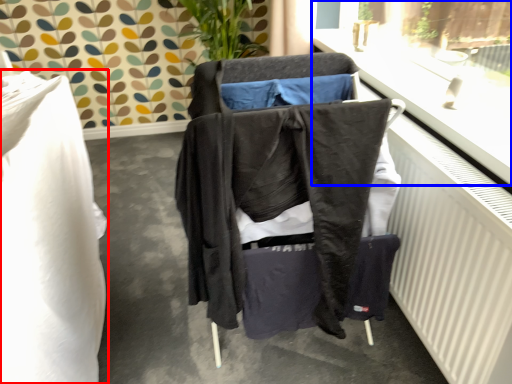
Question: Which object appears closest to the camera in this image, furniture (highlighted by a red box) or window frame (highlighted by a blue box)?

Choices:
 (A) furniture
 (B) window frame

Answer: (B)